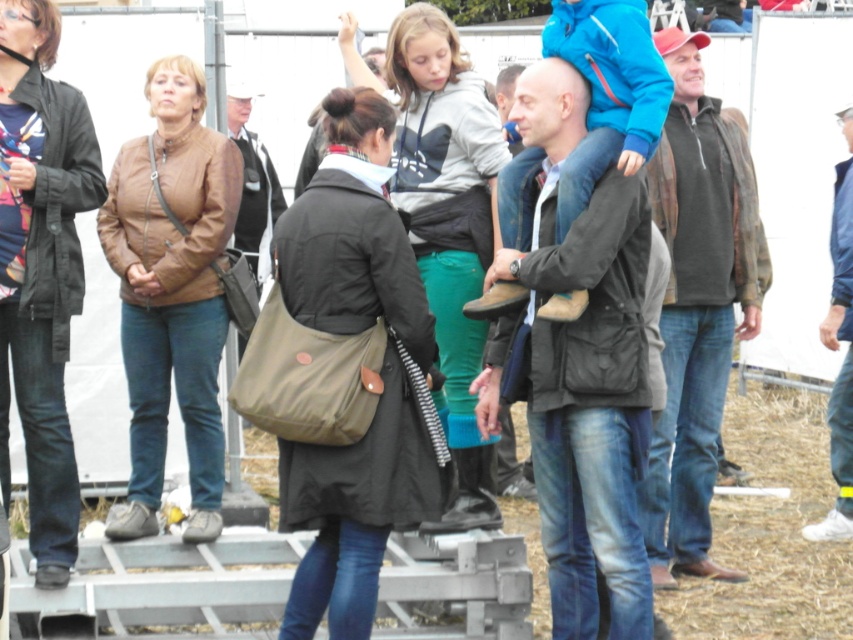
You are standing in the outdoor scene and want to move from point A at point (706, 164) to point B at point (462, 323). Since you can only move forward, will you be able to reach point B without turning around?

Point A at point (706, 164) is further to the viewer than point B at point (462, 323). Since you can only move forward, you can reach point B at point (462, 323) by moving towards it without needing to turn around.

Based on the photo, you are at a gathering and need to locate two items in the scene. There is an olive green fabric bag at center and a dark gray jacket at center. Which one is positioned to the left?

The olive green fabric bag at center is to the left of the dark gray jacket at center.